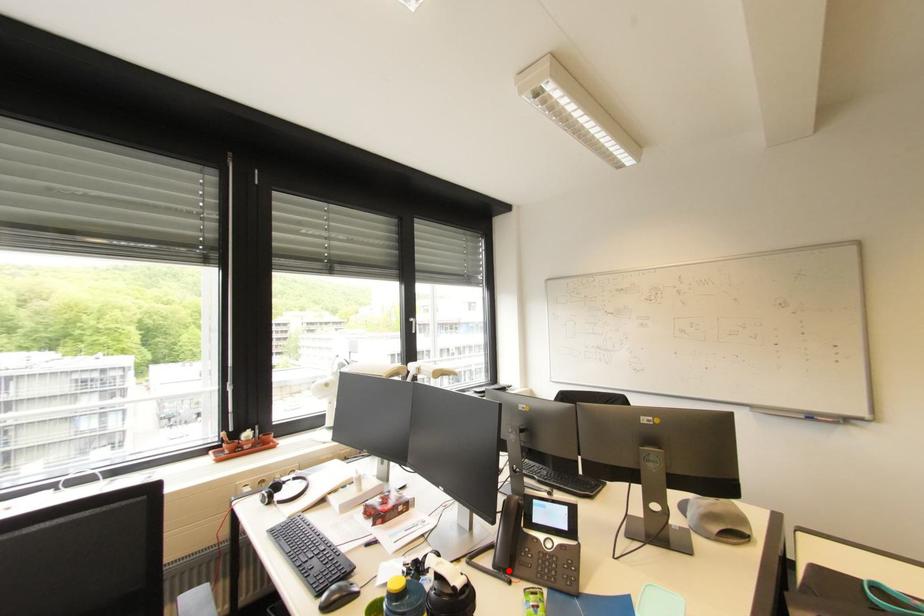
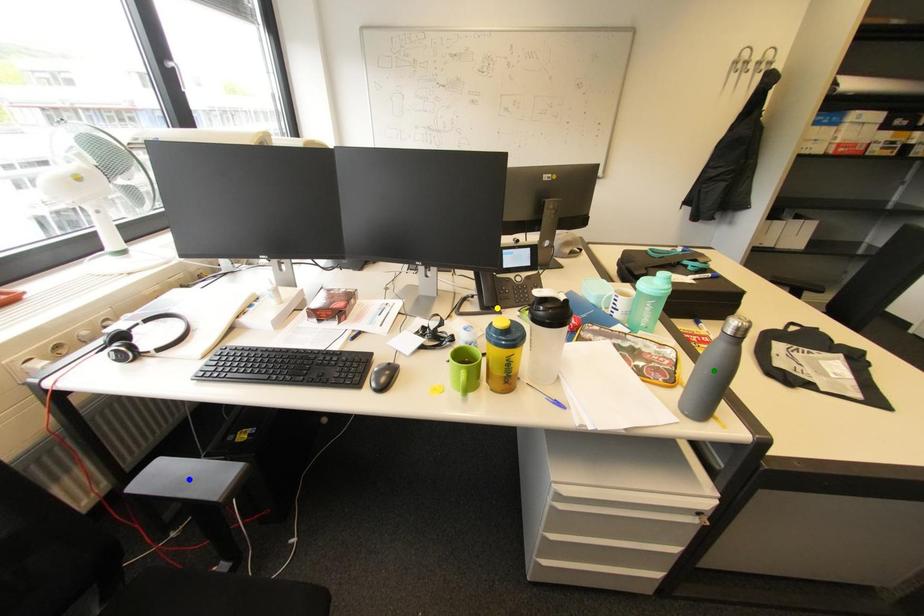
Question: I am providing you with two images of the same scene from different viewpoints. A red point is marked on the first image. You are given multiple points on the second image. In image 2, which mark is for the same physical point as the one in image 1?

Choices:
 (A) green point
 (B) blue point
 (C) yellow point

Answer: (C)